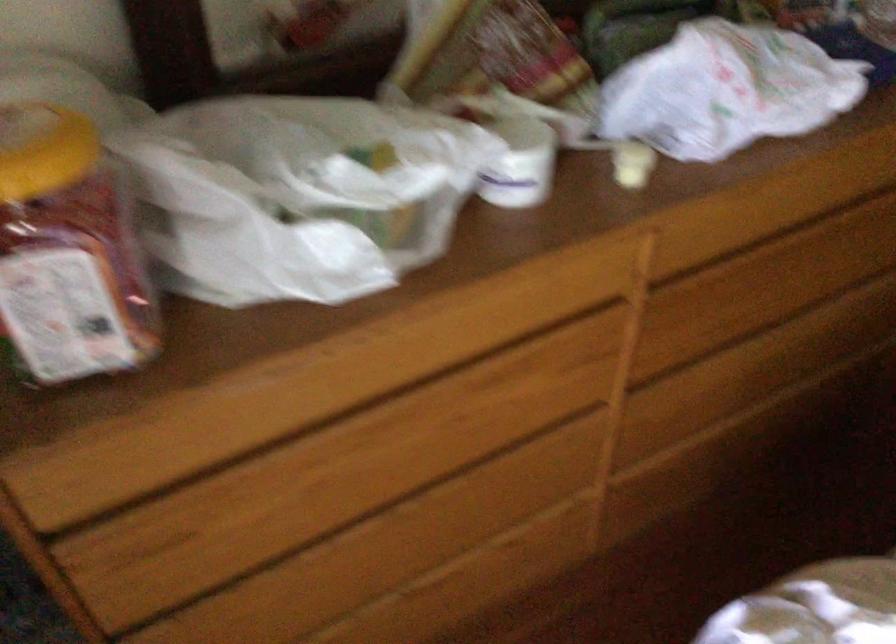
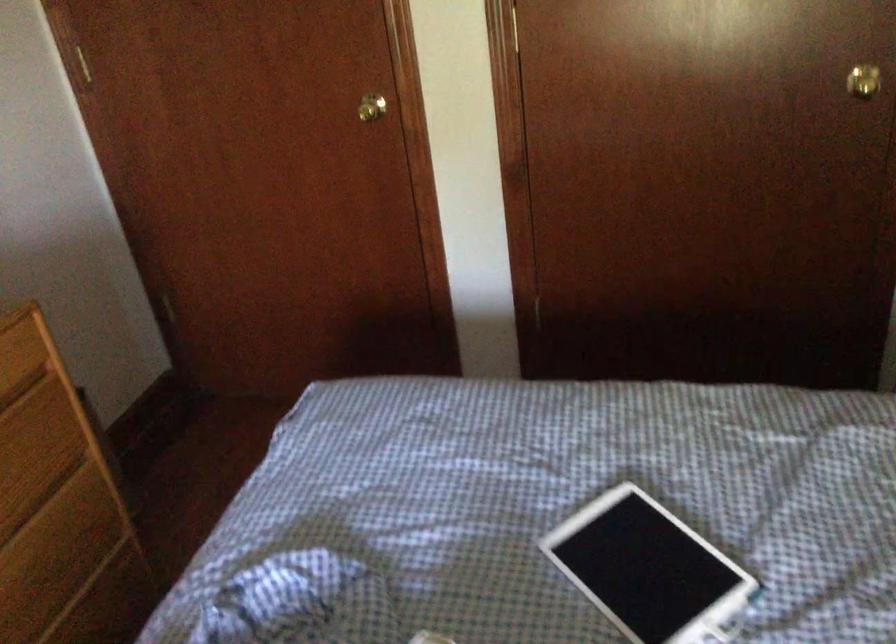
Question: How did the camera likely rotate?

Choices:
 (A) Left
 (B) Right
 (C) Up
 (D) Down

Answer: (B)